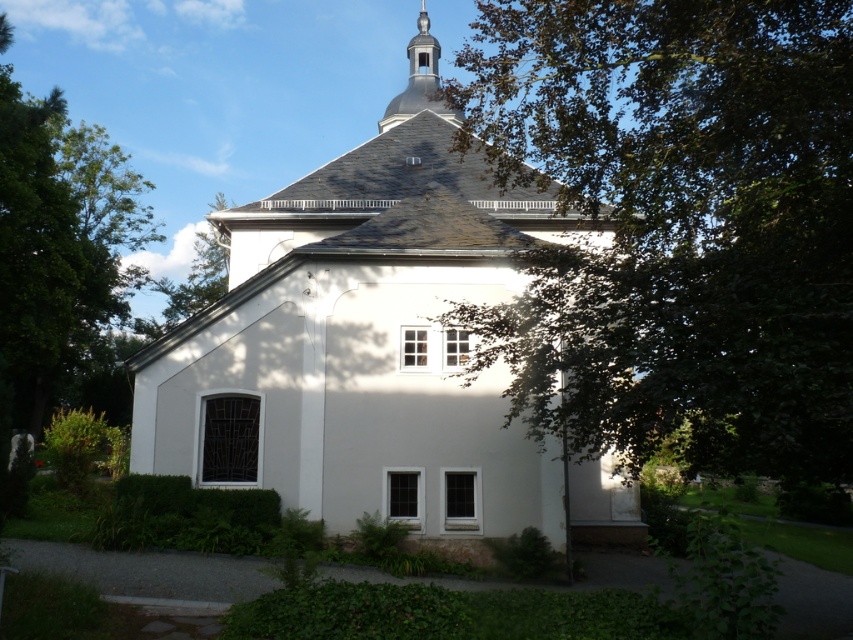
Question: Which point appears farthest from the camera in this image?

Choices:
 (A) (605, 483)
 (B) (635, 317)
 (C) (418, 33)
 (D) (38, 384)

Answer: (D)

Question: Where is green leafy tree at center located in relation to green leafy tree at left in the image?

Choices:
 (A) below
 (B) above

Answer: (B)

Question: Where is green leafy tree at center located in relation to smooth gray spire at upper center in the image?

Choices:
 (A) above
 (B) below

Answer: (B)

Question: Which point appears closest to the camera in this image?

Choices:
 (A) (78, 141)
 (B) (425, 100)

Answer: (B)

Question: Which of the following is the farthest from the observer?

Choices:
 (A) green leafy tree at center
 (B) white smooth church at center
 (C) green leafy tree at left
 (D) smooth gray spire at upper center

Answer: (D)

Question: Does white smooth church at center appear under green leafy tree at left?

Choices:
 (A) no
 (B) yes

Answer: (B)